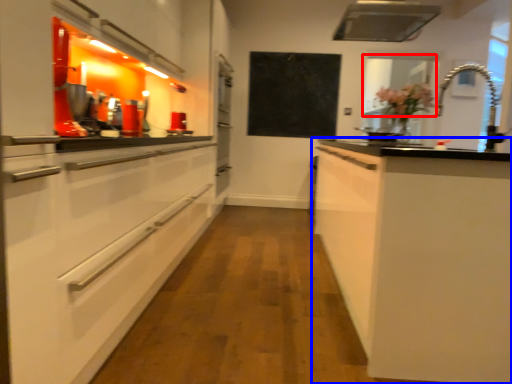
Question: Among these objects, which one is nearest to the camera, window screen (highlighted by a red box) or cabinetry (highlighted by a blue box)?

Choices:
 (A) window screen
 (B) cabinetry

Answer: (B)